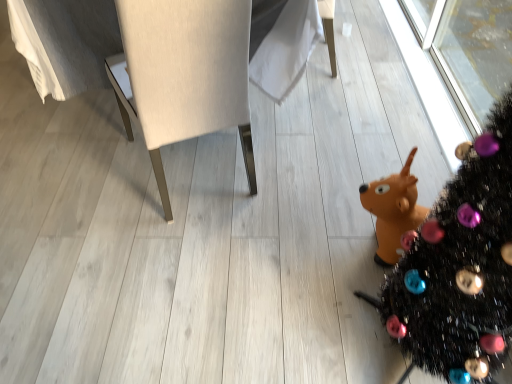
Question: Would you say matte white chair at center is to the left or to the right of black glittery christmas tree at lower right in the picture?

Choices:
 (A) left
 (B) right

Answer: (A)

Question: From a real-world perspective, is matte white chair at center positioned above or below black glittery christmas tree at lower right?

Choices:
 (A) below
 (B) above

Answer: (A)

Question: In the image, is matte white chair at center positioned in front of or behind black glittery christmas tree at lower right?

Choices:
 (A) behind
 (B) front

Answer: (A)

Question: Considering the positions of black glittery christmas tree at lower right and matte white chair at center in the image, is black glittery christmas tree at lower right wider or thinner than matte white chair at center?

Choices:
 (A) wide
 (B) thin

Answer: (B)

Question: Does point (479, 228) appear closer or farther from the camera than point (176, 140)?

Choices:
 (A) farther
 (B) closer

Answer: (B)

Question: Considering the positions of black glittery christmas tree at lower right and matte white chair at center in the image, is black glittery christmas tree at lower right taller or shorter than matte white chair at center?

Choices:
 (A) short
 (B) tall

Answer: (B)

Question: Do you think black glittery christmas tree at lower right is within matte white chair at center, or outside of it?

Choices:
 (A) outside
 (B) inside

Answer: (A)